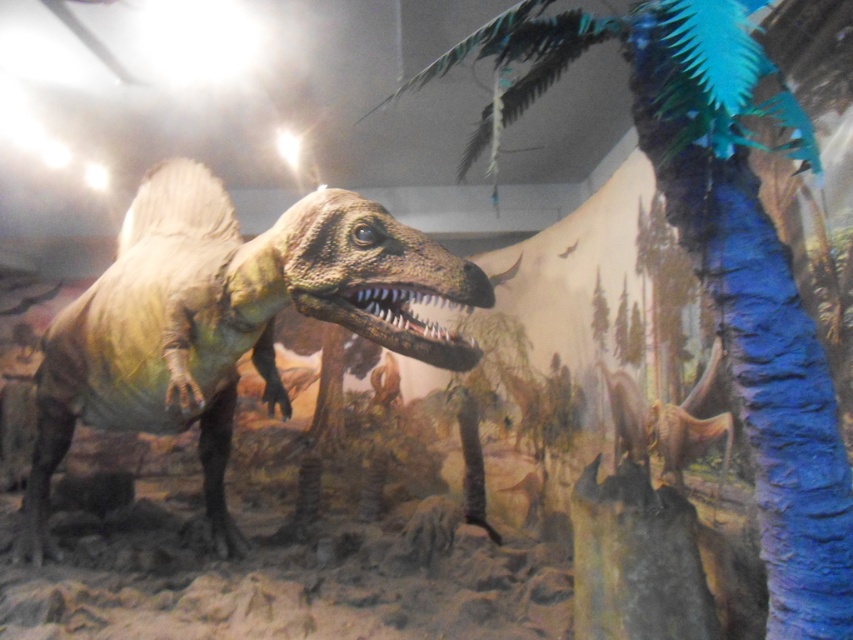
Question: Which object appears farthest from the camera in this image?

Choices:
 (A) blue feathered palm tree at center
 (B) shiny metallic dinosaur at center

Answer: (B)

Question: Is the position of blue feathered palm tree at center less distant than that of shiny metallic dinosaur at center?

Choices:
 (A) no
 (B) yes

Answer: (B)

Question: Does blue feathered palm tree at center appear under shiny metallic dinosaur at center?

Choices:
 (A) yes
 (B) no

Answer: (B)

Question: Is blue feathered palm tree at center positioned at the back of shiny metallic dinosaur at center?

Choices:
 (A) no
 (B) yes

Answer: (A)

Question: Which of the following is the closest to the observer?

Choices:
 (A) (440, 272)
 (B) (727, 150)

Answer: (B)